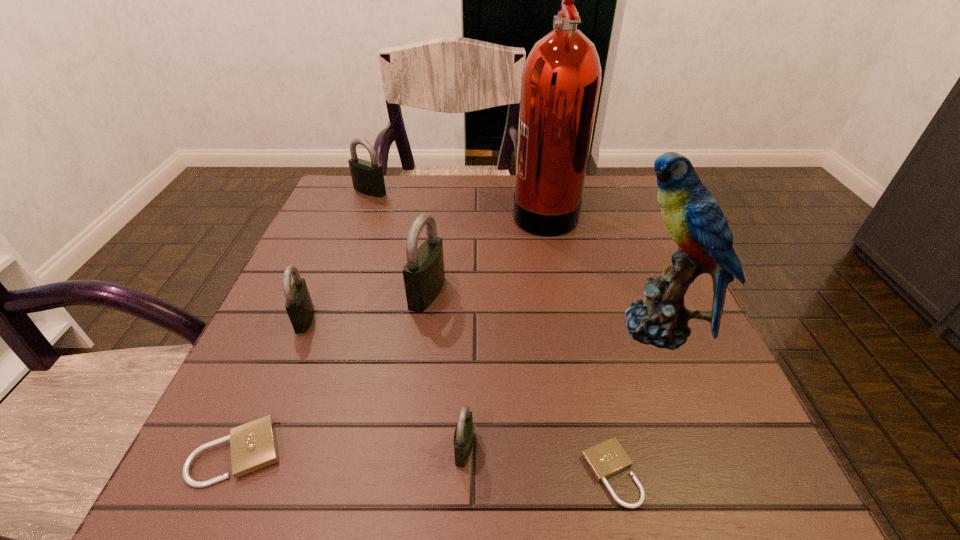
Where is `the rightmost black padlock`? This screenshot has width=960, height=540. the rightmost black padlock is located at coordinates (463, 437).

The image size is (960, 540). Find the location of `the fifth padlock from left to right`. the fifth padlock from left to right is located at coordinates (463, 437).

The height and width of the screenshot is (540, 960). Find the location of `the left beige padlock`. the left beige padlock is located at coordinates pyautogui.click(x=253, y=445).

Find the location of a particular element. the bigger beige padlock is located at coordinates (253, 445).

Where is `the right beige padlock`? the right beige padlock is located at coordinates (x=608, y=458).

At what (x,y) coordinates should I click in order to perform the action: click on the smaller beige padlock. Please return your answer as a coordinate pair (x, y). Looking at the image, I should click on (608, 458).

You are a GUI agent. You are given a task and a screenshot of the screen. Output one action in this format:
    pyautogui.click(x=<x>, y=<y>)
    Task: Click on the vacant space situated on the front-facing side of the tallest object
    
    Given the screenshot: What is the action you would take?
    [x=393, y=211]

Find the location of a particular element. free space located on the front-facing side of the tallest object is located at coordinates (433, 211).

Where is `vacant space located 0.360m on the front-facing side of the tallest object`? This screenshot has width=960, height=540. vacant space located 0.360m on the front-facing side of the tallest object is located at coordinates (370, 211).

Locate an element on the screen. This screenshot has width=960, height=540. free region located on the face of the second tallest object is located at coordinates [x=445, y=327].